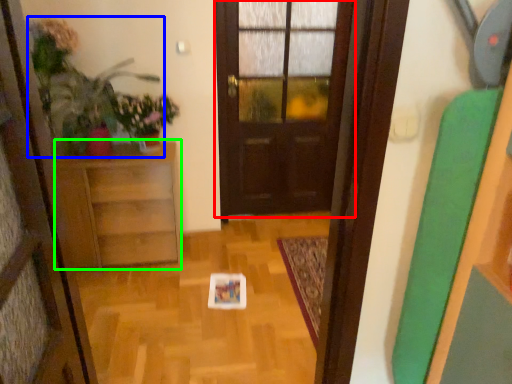
Question: Considering the real-world distances, which object is farthest from door (highlighted by a red box)? plant (highlighted by a blue box) or furniture (highlighted by a green box)?

Choices:
 (A) plant
 (B) furniture

Answer: (A)